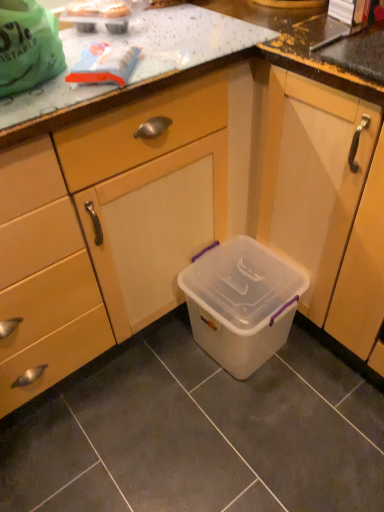
This screenshot has width=384, height=512. What do you see at coordinates (241, 303) in the screenshot?
I see `transparent plastic storage box at center` at bounding box center [241, 303].

This screenshot has width=384, height=512. In order to click on transparent plastic storage box at center in this screenshot , I will do `click(241, 303)`.

The height and width of the screenshot is (512, 384). Find the location of `transparent plastic container at lower center`. transparent plastic container at lower center is located at coordinates point(313,177).

Describe the element at coordinates (313, 177) in the screenshot. The width and height of the screenshot is (384, 512). I see `transparent plastic container at lower center` at that location.

Based on the photo, in order to face transparent plastic container at lower center, should I rotate leftwards or rightwards?

A 25.713 degree turn to the right will do.

What is the approximate height of transparent plastic container at lower center?

35.31 inches.

Locate an element on the screen. This screenshot has height=512, width=384. transparent plastic storage box at center is located at coordinates (241, 303).

Based on their positions, is transparent plastic container at lower center located to the left or right of transparent plastic storage box at center?

In the image, transparent plastic container at lower center appears on the right side of transparent plastic storage box at center.

Is transparent plastic container at lower center closer to the viewer compared to transparent plastic storage box at center?

Yes, transparent plastic container at lower center is closer to the viewer.

Considering the positions of point (329, 98) and point (257, 357), is point (329, 98) closer or farther from the camera than point (257, 357)?

Point (329, 98).

In the scene shown: From the image's perspective, would you say transparent plastic container at lower center is positioned over transparent plastic storage box at center?

Correct, transparent plastic container at lower center appears higher than transparent plastic storage box at center in the image.

From a real-world perspective, is transparent plastic container at lower center positioned over transparent plastic storage box at center based on gravity?

Yes, from a real-world perspective, transparent plastic container at lower center is over transparent plastic storage box at center

Is transparent plastic container at lower center wider or thinner than transparent plastic storage box at center?

transparent plastic container at lower center is wider than transparent plastic storage box at center.

From their relative heights in the image, would you say transparent plastic container at lower center is taller or shorter than transparent plastic storage box at center?

transparent plastic container at lower center is taller than transparent plastic storage box at center.

In terms of size, does transparent plastic container at lower center appear bigger or smaller than transparent plastic storage box at center?

Considering their sizes, transparent plastic container at lower center takes up more space than transparent plastic storage box at center.

Is transparent plastic container at lower center surrounding transparent plastic storage box at center?

No, transparent plastic storage box at center is not a part of transparent plastic container at lower center.

Is transparent plastic container at lower center placed right next to transparent plastic storage box at center?

transparent plastic container at lower center and transparent plastic storage box at center are not in contact.

Is transparent plastic container at lower center aimed at transparent plastic storage box at center?

Yes, transparent plastic container at lower center is aimed at transparent plastic storage box at center.

How many degrees apart are the facing directions of transparent plastic container at lower center and transparent plastic storage box at center?

They differ by 0.000894 degrees in their facing directions.

Measure the distance from transparent plastic container at lower center to transparent plastic storage box at center.

The distance of transparent plastic container at lower center from transparent plastic storage box at center is 9.32 inches.

The image size is (384, 512). I want to click on storage box lying below the transparent plastic container at lower center (from the image's perspective), so click(x=241, y=303).

Considering the relative positions of transparent plastic storage box at center and transparent plastic container at lower center in the image provided, is transparent plastic storage box at center to the left or to the right of transparent plastic container at lower center?

transparent plastic storage box at center is to the left of transparent plastic container at lower center.

Is transparent plastic storage box at center positioned behind transparent plastic container at lower center?

Yes, transparent plastic storage box at center is further from the viewer.

Which is in front, point (245, 346) or point (325, 309)?

The point (245, 346) is more forward.

From the image's perspective, which is above, transparent plastic storage box at center or transparent plastic container at lower center?

From the image's view, transparent plastic container at lower center is above.

From a real-world perspective, is transparent plastic storage box at center positioned above or below transparent plastic container at lower center?

Clearly, from a real-world perspective, transparent plastic storage box at center is below transparent plastic container at lower center.

Can you confirm if transparent plastic storage box at center is wider than transparent plastic container at lower center?

In fact, transparent plastic storage box at center might be narrower than transparent plastic container at lower center.

Which of these two, transparent plastic storage box at center or transparent plastic container at lower center, stands shorter?

Standing shorter between the two is transparent plastic storage box at center.

Can you confirm if transparent plastic storage box at center is smaller than transparent plastic container at lower center?

Indeed, transparent plastic storage box at center has a smaller size compared to transparent plastic container at lower center.

Would you say transparent plastic storage box at center is outside transparent plastic container at lower center?

Absolutely, transparent plastic storage box at center is external to transparent plastic container at lower center.

Is there a large distance between transparent plastic storage box at center and transparent plastic container at lower center?

No, transparent plastic storage box at center is not far from transparent plastic container at lower center.

Is transparent plastic storage box at center positioned with its back to transparent plastic container at lower center?

Correct, transparent plastic storage box at center is looking away from transparent plastic container at lower center.

Consider the image. How many degrees apart are the facing directions of transparent plastic storage box at center and transparent plastic container at lower center?

The angular difference between transparent plastic storage box at center and transparent plastic container at lower center is 0.000894 degrees.

Locate an element on the screen. Image resolution: width=384 pixels, height=512 pixels. storage box below the transparent plastic container at lower center (from a real-world perspective) is located at coordinates (241, 303).

The height and width of the screenshot is (512, 384). In order to click on cabinetry in front of the transparent plastic storage box at center in this screenshot , I will do `click(313, 177)`.

Find the location of a particular element. This screenshot has height=512, width=384. storage box on the left side of transparent plastic container at lower center is located at coordinates pyautogui.click(x=241, y=303).